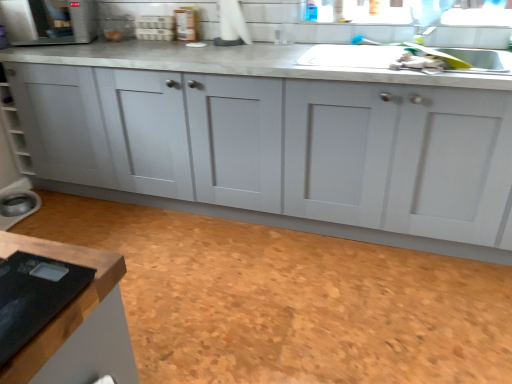
At what (x,y) coordinates should I click in order to perform the action: click on free spot to the right of matte white kettle at lower left, the 1th appliance from the bottom. Please return your answer as a coordinate pair (x, y). Image resolution: width=512 pixels, height=384 pixels. Looking at the image, I should click on (54, 213).